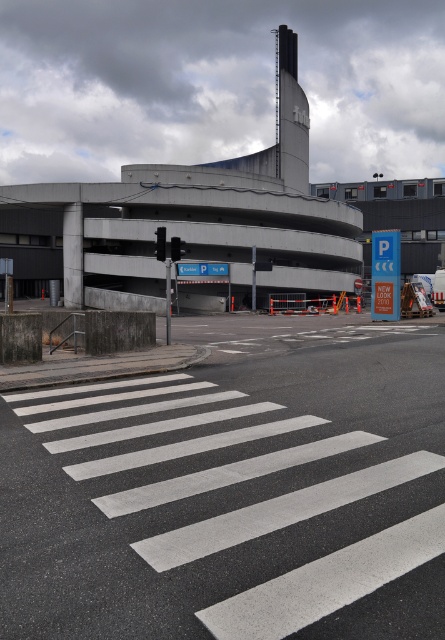
Can you confirm if white asphalt crosswalk at center is thinner than red glass traffic light at center?

No, white asphalt crosswalk at center is not thinner than red glass traffic light at center.

Identify the location of white asphalt crosswalk at center. The width and height of the screenshot is (445, 640). (235, 492).

Locate an element on the screen. white asphalt crosswalk at center is located at coordinates tap(235, 492).

Between point (241, 548) and point (161, 234), which one is positioned in front?

Point (241, 548) is in front.

Can you confirm if white asphalt crosswalk at center is positioned above black glass traffic light at center?

No, white asphalt crosswalk at center is not above black glass traffic light at center.

The width and height of the screenshot is (445, 640). In order to click on white asphalt crosswalk at center in this screenshot , I will do tap(235, 492).

From the picture: Does black glass traffic light at center appear on the left side of red glass traffic light at center?

Yes, black glass traffic light at center is to the left of red glass traffic light at center.

Is black glass traffic light at center taller than red glass traffic light at center?

Indeed, black glass traffic light at center has a greater height compared to red glass traffic light at center.

The width and height of the screenshot is (445, 640). I want to click on black glass traffic light at center, so click(160, 243).